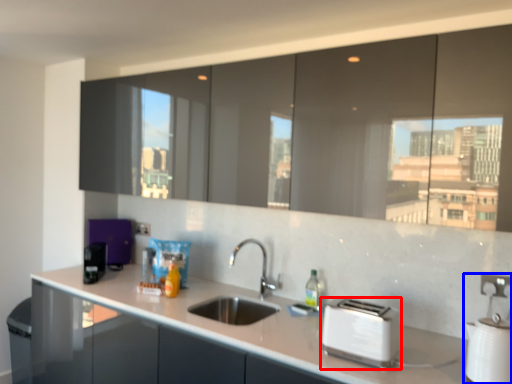
Question: Which object appears closest to the camera in this image, toaster (highlighted by a red box) or appliance (highlighted by a blue box)?

Choices:
 (A) toaster
 (B) appliance

Answer: (B)